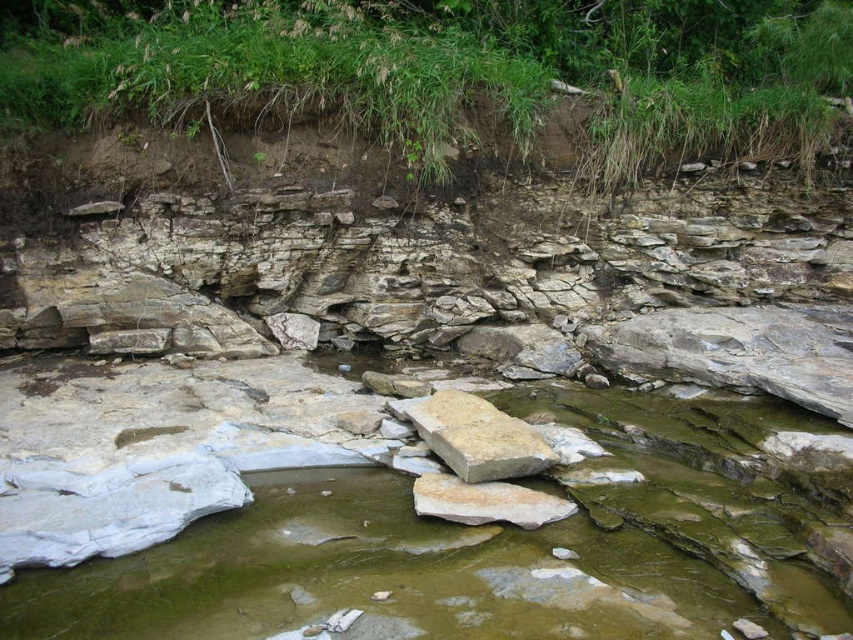
Does light brown rock at center appear over smooth beige rock at center?

Yes, light brown rock at center is above smooth beige rock at center.

Who is more distant from viewer, (448,406) or (550,509)?

The point (448,406) is behind.

This screenshot has width=853, height=640. What are the coordinates of `light brown rock at center` in the screenshot? It's located at (479, 436).